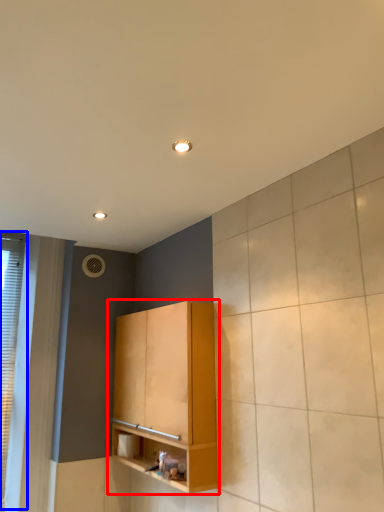
Question: Which of the following is the closest to the observer, cabinetry (highlighted by a red box) or window (highlighted by a blue box)?

Choices:
 (A) cabinetry
 (B) window

Answer: (A)